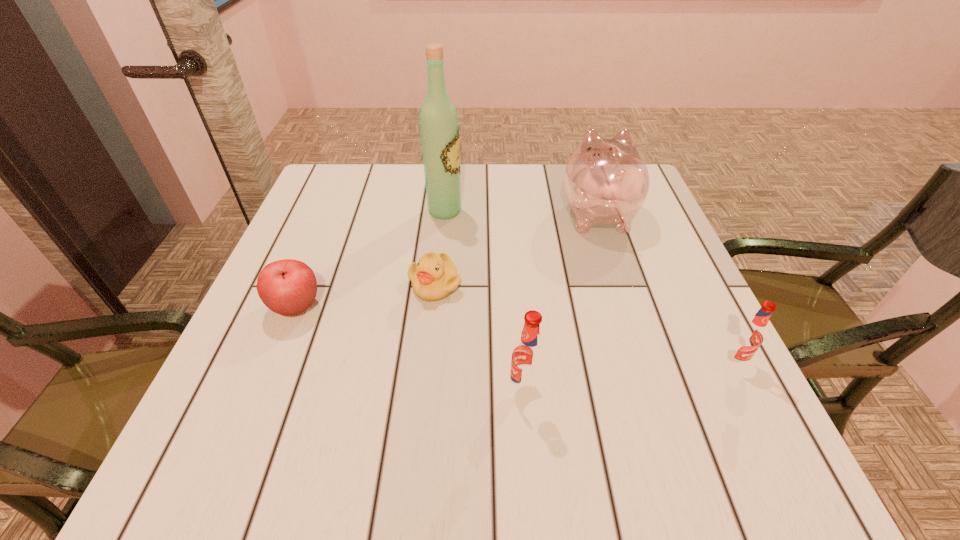
The image size is (960, 540). I want to click on vacant point located on the left of the rightmost object, so click(x=503, y=361).

At what (x,y) coordinates should I click in order to perform the action: click on free space located 0.160m on the front-facing side of the tallest object. Please return your answer as a coordinate pair (x, y). Looking at the image, I should click on (525, 211).

Identify the location of free space located 0.110m on the front facing side of the fifth object from left to right. This screenshot has width=960, height=540. (583, 168).

This screenshot has height=540, width=960. In order to click on blank space located on the front facing side of the fifth object from left to right in this screenshot , I will do `click(582, 165)`.

At what (x,y) coordinates should I click in order to perform the action: click on vacant space located 0.110m on the front facing side of the fifth object from left to right. Please return your answer as a coordinate pair (x, y). The height and width of the screenshot is (540, 960). Looking at the image, I should click on (583, 168).

Locate an element on the screen. The height and width of the screenshot is (540, 960). vacant space positioned on the right of the apple is located at coordinates (383, 307).

You are a GUI agent. You are given a task and a screenshot of the screen. Output one action in this format:
    pyautogui.click(x=<x>, y=<y>)
    Task: Click on the free region located on the front-facing side of the duckling
    The width and height of the screenshot is (960, 540).
    Given the screenshot: What is the action you would take?
    click(x=428, y=352)

Locate an element on the screen. The image size is (960, 540). wine bottle situated at the far edge is located at coordinates (439, 128).

What are the coordinates of `piggy bank at the far edge` in the screenshot? It's located at (606, 181).

The width and height of the screenshot is (960, 540). What are the coordinates of `object that is at the near edge` in the screenshot? It's located at (528, 356).